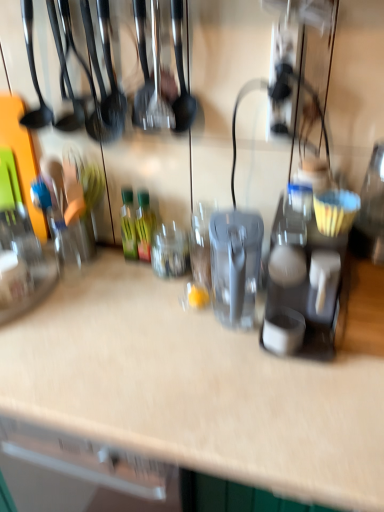
What do you see at coordinates (128, 225) in the screenshot? I see `green glass bottle at center, positioned as the first bottle in left-to-right order` at bounding box center [128, 225].

What is the approximate width of matte gray coffee maker at center right?

It is 13.60 inches.

Image resolution: width=384 pixels, height=512 pixels. In order to click on green glass bottle at center, the 2th bottle viewed from the left in this screenshot , I will do [144, 225].

Based on their positions, is green glass bottle at center, the 2th bottle viewed from the left, located to the left or right of green glass bottle at center, positioned as the first bottle in left-to-right order?

Based on their positions, green glass bottle at center, the 2th bottle viewed from the left, is located to the right of green glass bottle at center, positioned as the first bottle in left-to-right order.

How different are the orientations of green glass bottle at center, which ranks as the first bottle in right-to-left order, and green glass bottle at center, positioned as the first bottle in left-to-right order, in degrees?

0.000122 degrees.

From a real-world perspective, is green glass bottle at center, the 2th bottle viewed from the left, on green glass bottle at center, the 2th bottle when ordered from right to left?

Incorrect, from a real-world perspective, green glass bottle at center, the 2th bottle viewed from the left, is lower than green glass bottle at center, the 2th bottle when ordered from right to left.

Are green glass bottle at center, the 2th bottle viewed from the left, and green glass bottle at center, positioned as the first bottle in left-to-right order, beside each other?

Yes, green glass bottle at center, the 2th bottle viewed from the left, is beside green glass bottle at center, positioned as the first bottle in left-to-right order.

Is there a large distance between matte gray coffee maker at center right and green glass bottle at center, the 2th bottle when ordered from right to left?

No, matte gray coffee maker at center right is not far away from green glass bottle at center, the 2th bottle when ordered from right to left.

There is a green glass bottle at center, positioned as the first bottle in left-to-right order. Identify the location of appliance above it (from a real-world perspective). The image size is (384, 512). (303, 289).

From a real-world perspective, is matte gray coffee maker at center right on top of green glass bottle at center, the 2th bottle when ordered from right to left?

Yes, from a real-world perspective, matte gray coffee maker at center right is above green glass bottle at center, the 2th bottle when ordered from right to left.

Is green glass bottle at center, the 2th bottle viewed from the left, situated inside matte gray coffee maker at center right or outside?

green glass bottle at center, the 2th bottle viewed from the left, is not inside matte gray coffee maker at center right, it's outside.

Starting from the matte gray coffee maker at center right, which bottle is the 1st one to the left? Please provide its 2D coordinates.

[(144, 225)]

Is green glass bottle at center, the 2th bottle viewed from the left, taller than matte gray coffee maker at center right?

In fact, green glass bottle at center, the 2th bottle viewed from the left, may be shorter than matte gray coffee maker at center right.

Considering the relative sizes of green glass bottle at center, the 2th bottle viewed from the left, and matte gray coffee maker at center right in the image provided, is green glass bottle at center, the 2th bottle viewed from the left, thinner than matte gray coffee maker at center right?

Yes, green glass bottle at center, the 2th bottle viewed from the left, is thinner than matte gray coffee maker at center right.

From the image's perspective, which one is positioned higher, green glass bottle at center, positioned as the first bottle in left-to-right order, or matte gray coffee maker at center right?

From the image's view, green glass bottle at center, positioned as the first bottle in left-to-right order, is above.

Is green glass bottle at center, positioned as the first bottle in left-to-right order, taller or shorter than matte gray coffee maker at center right?

Clearly, green glass bottle at center, positioned as the first bottle in left-to-right order, is shorter compared to matte gray coffee maker at center right.

Looking at this image, from a real-world perspective, is green glass bottle at center, the 2th bottle when ordered from right to left, located higher than matte gray coffee maker at center right?

No, from a real-world perspective, green glass bottle at center, the 2th bottle when ordered from right to left, is not above matte gray coffee maker at center right.

Is point (127, 213) behind point (297, 223)?

Yes, it is behind point (297, 223).

From the image's perspective, is matte gray coffee maker at center right on green glass bottle at center, which ranks as the first bottle in right-to-left order?

No, from the image's perspective, matte gray coffee maker at center right is not over green glass bottle at center, which ranks as the first bottle in right-to-left order.

Who is shorter, matte gray coffee maker at center right or green glass bottle at center, the 2th bottle viewed from the left?

Standing shorter between the two is green glass bottle at center, the 2th bottle viewed from the left.

This screenshot has height=512, width=384. What are the coordinates of `bottle that is the 1st object located behind the matte gray coffee maker at center right` in the screenshot? It's located at (144, 225).

From the picture: Can you confirm if matte gray coffee maker at center right is positioned to the left of green glass bottle at center, the 2th bottle viewed from the left?

No.

In terms of size, does green glass bottle at center, positioned as the first bottle in left-to-right order, appear bigger or smaller than green glass bottle at center, which ranks as the first bottle in right-to-left order?

green glass bottle at center, positioned as the first bottle in left-to-right order, is smaller than green glass bottle at center, which ranks as the first bottle in right-to-left order.

Considering the sizes of green glass bottle at center, the 2th bottle when ordered from right to left, and green glass bottle at center, the 2th bottle viewed from the left, in the image, is green glass bottle at center, the 2th bottle when ordered from right to left, taller or shorter than green glass bottle at center, the 2th bottle viewed from the left,?

green glass bottle at center, the 2th bottle when ordered from right to left, is shorter than green glass bottle at center, the 2th bottle viewed from the left.

Is green glass bottle at center, the 2th bottle viewed from the left, at the back of green glass bottle at center, the 2th bottle when ordered from right to left?

That's not correct — green glass bottle at center, the 2th bottle when ordered from right to left, is not looking away from green glass bottle at center, the 2th bottle viewed from the left.

You are a GUI agent. You are given a task and a screenshot of the screen. Output one action in this format:
    pyautogui.click(x=<x>, y=<y>)
    Task: Click on the bottle above the green glass bottle at center, the 2th bottle viewed from the left (from a real-world perspective)
    
    Given the screenshot: What is the action you would take?
    pyautogui.click(x=128, y=225)

Find the location of a particular element. Image resolution: width=384 pixels, height=512 pixels. bottle on the left of green glass bottle at center, the 2th bottle viewed from the left is located at coordinates (128, 225).

The width and height of the screenshot is (384, 512). Find the location of `bottle that is the 2nd one when counting backward from the matte gray coffee maker at center right`. bottle that is the 2nd one when counting backward from the matte gray coffee maker at center right is located at coordinates (128, 225).

From the image, which object appears to be nearer to green glass bottle at center, the 2th bottle when ordered from right to left, matte gray coffee maker at center right or green glass bottle at center, which ranks as the first bottle in right-to-left order?

green glass bottle at center, which ranks as the first bottle in right-to-left order.

Estimate the real-world distances between objects in this image. Which object is closer to matte gray coffee maker at center right, green glass bottle at center, the 2th bottle viewed from the left, or green glass bottle at center, the 2th bottle when ordered from right to left?

Among the two, green glass bottle at center, the 2th bottle viewed from the left, is located nearer to matte gray coffee maker at center right.

Looking at this image, based on their spatial positions, is green glass bottle at center, the 2th bottle when ordered from right to left, or green glass bottle at center, the 2th bottle viewed from the left, further from matte gray coffee maker at center right?

green glass bottle at center, the 2th bottle when ordered from right to left, lies further to matte gray coffee maker at center right than the other object.

Based on the photo, from the image, which object appears to be farther from green glass bottle at center, the 2th bottle when ordered from right to left, green glass bottle at center, which ranks as the first bottle in right-to-left order, or matte gray coffee maker at center right?

The object further to green glass bottle at center, the 2th bottle when ordered from right to left, is matte gray coffee maker at center right.

When comparing their distances from green glass bottle at center, which ranks as the first bottle in right-to-left order, does matte gray coffee maker at center right or green glass bottle at center, the 2th bottle when ordered from right to left, seem closer?

Based on the image, green glass bottle at center, the 2th bottle when ordered from right to left, appears to be nearer to green glass bottle at center, which ranks as the first bottle in right-to-left order.

From the image, which object appears to be farther from green glass bottle at center, which ranks as the first bottle in right-to-left order, green glass bottle at center, positioned as the first bottle in left-to-right order, or matte gray coffee maker at center right?

Based on the image, matte gray coffee maker at center right appears to be further to green glass bottle at center, which ranks as the first bottle in right-to-left order.

Identify the location of bottle situated between green glass bottle at center, the 2th bottle when ordered from right to left, and matte gray coffee maker at center right from left to right. (144, 225).